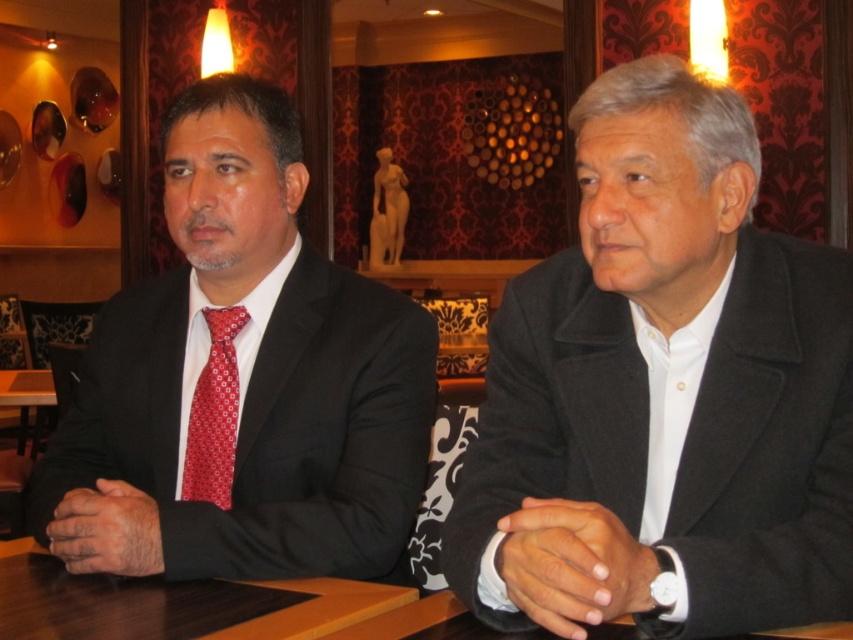
Can you confirm if black wool coat at right is positioned above red silk tie at left?

Yes, black wool coat at right is above red silk tie at left.

Does black wool coat at right appear on the right side of red silk tie at left?

Correct, you'll find black wool coat at right to the right of red silk tie at left.

At what (x,y) coordinates should I click in order to perform the action: click on black wool coat at right. Please return your answer as a coordinate pair (x, y). Image resolution: width=853 pixels, height=640 pixels. Looking at the image, I should click on (663, 392).

Between brown wooden table at center and red silk tie at left, which one has more height?

red silk tie at left is taller.

Does brown wooden table at center appear over red silk tie at left?

No, brown wooden table at center is not above red silk tie at left.

Which is behind, point (15, 579) or point (230, 369)?

The point (230, 369) is behind.

Identify the location of brown wooden table at center. (175, 604).

Can you confirm if black wool coat at right is positioned to the right of brown wooden table at center?

Indeed, black wool coat at right is positioned on the right side of brown wooden table at center.

Can you confirm if black wool coat at right is smaller than brown wooden table at center?

No.

Identify the location of black wool coat at right. The image size is (853, 640). (663, 392).

At what (x,y) coordinates should I click in order to perform the action: click on black wool coat at right. Please return your answer as a coordinate pair (x, y). The height and width of the screenshot is (640, 853). Looking at the image, I should click on (663, 392).